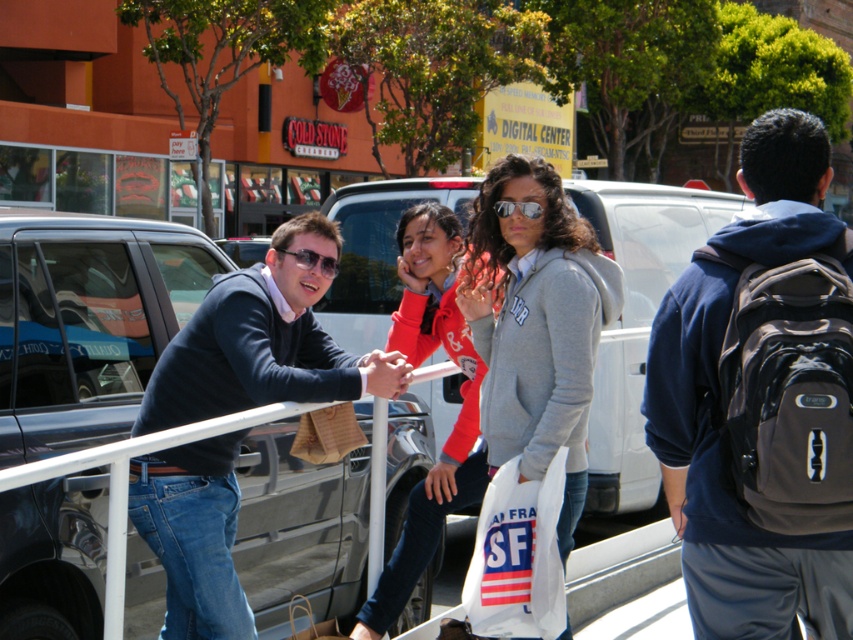
Question: Which object is positioned farthest from the white plastic bag at center?

Choices:
 (A) dark blue sweater at center
 (B) gray fabric backpack at right

Answer: (A)

Question: Does dark blue sweater at center appear on the left side of white plastic bag at center?

Choices:
 (A) no
 (B) yes

Answer: (B)

Question: Which of the following is the closest to the observer?

Choices:
 (A) dark blue sweater at center
 (B) gray fabric backpack at right
 (C) gray fleece hoodie at center

Answer: (B)

Question: Which point is farther to the camera?

Choices:
 (A) gray fabric backpack at right
 (B) white plastic bag at center
 (C) dark blue sweater at center

Answer: (B)

Question: Can you confirm if gray fabric backpack at right is wider than gray fleece hoodie at center?

Choices:
 (A) yes
 (B) no

Answer: (B)

Question: Where is gray fabric backpack at right located in relation to white plastic bag at center in the image?

Choices:
 (A) left
 (B) right

Answer: (B)